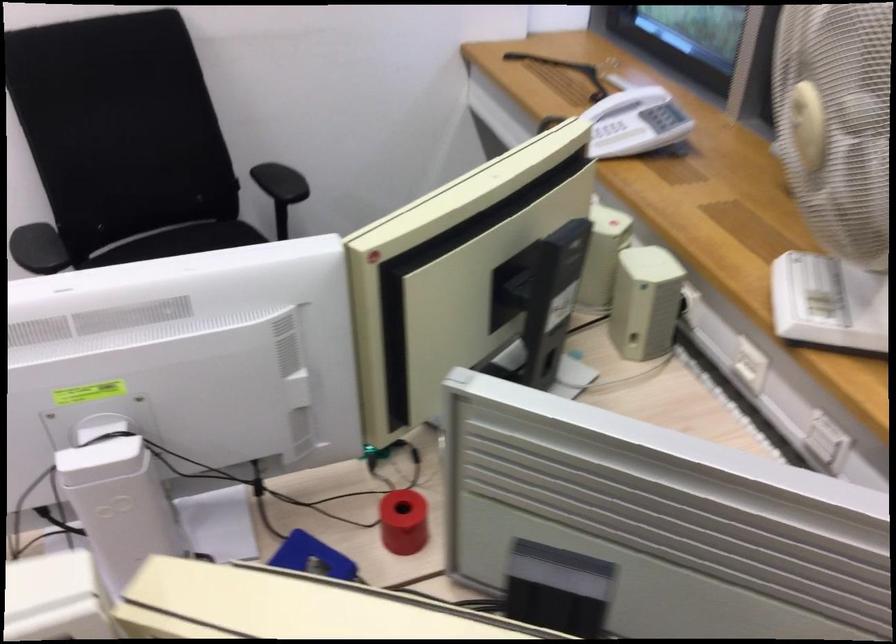
Locate an element on the screen. telephone keypad is located at coordinates (612, 131).